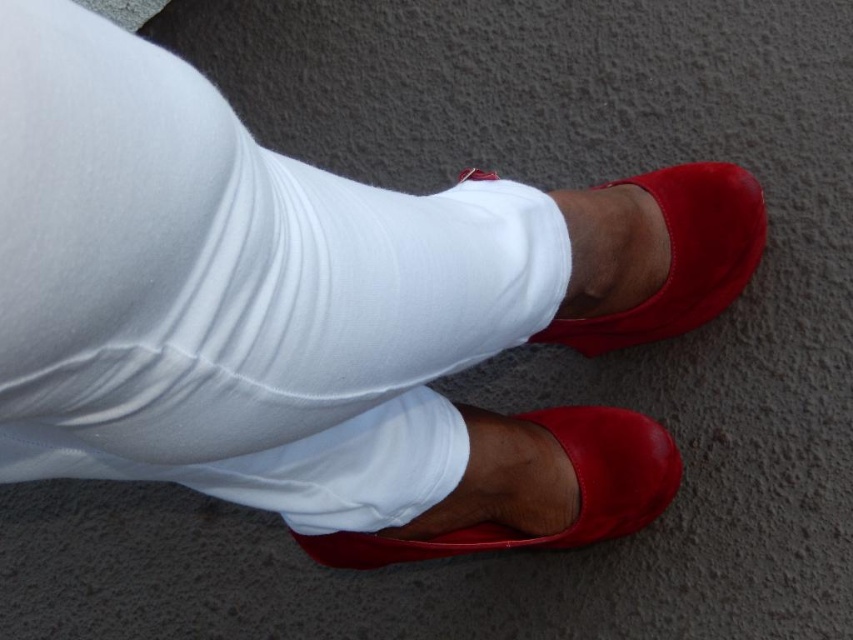
Question: Does shiny leather shoe at lower center appear on the left side of satin red shoe at center?

Choices:
 (A) yes
 (B) no

Answer: (A)

Question: Which point appears farthest from the camera in this image?

Choices:
 (A) (685, 202)
 (B) (462, 536)

Answer: (A)

Question: Which of the following is the closest to the observer?

Choices:
 (A) (570, 413)
 (B) (677, 272)

Answer: (B)

Question: Can you confirm if shiny leather shoe at lower center is bigger than satin red shoe at center?

Choices:
 (A) yes
 (B) no

Answer: (A)

Question: Can you confirm if shiny leather shoe at lower center is positioned above satin red shoe at center?

Choices:
 (A) no
 (B) yes

Answer: (A)